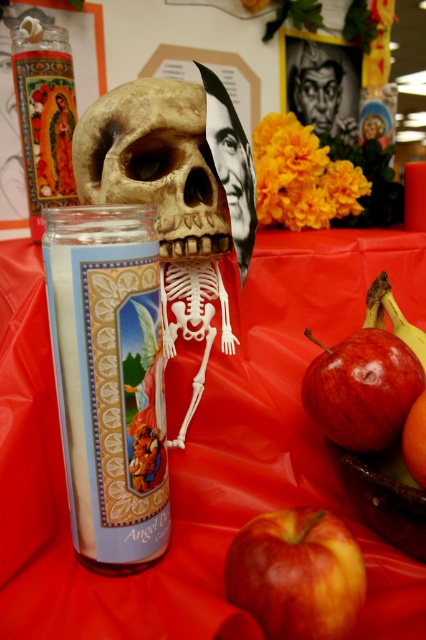
You are an altar visitor observing the items on the Day of the Dead altar. You notice the smooth black face at upper center and the orange matte at lower right. Which object is placed higher on the altar?

The smooth black face at upper center is positioned over the orange matte at lower right, so it is placed higher on the altar.

What is located at the point marked as coordinates (324, 84) on the altar?

The point marked as coordinates (324, 84) on the altar corresponds to the smooth black face at upper center.